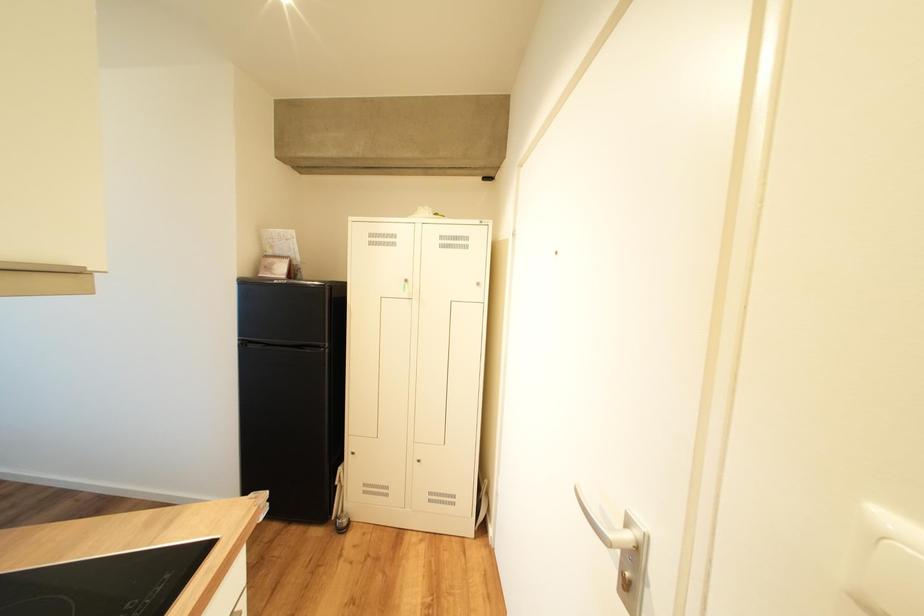
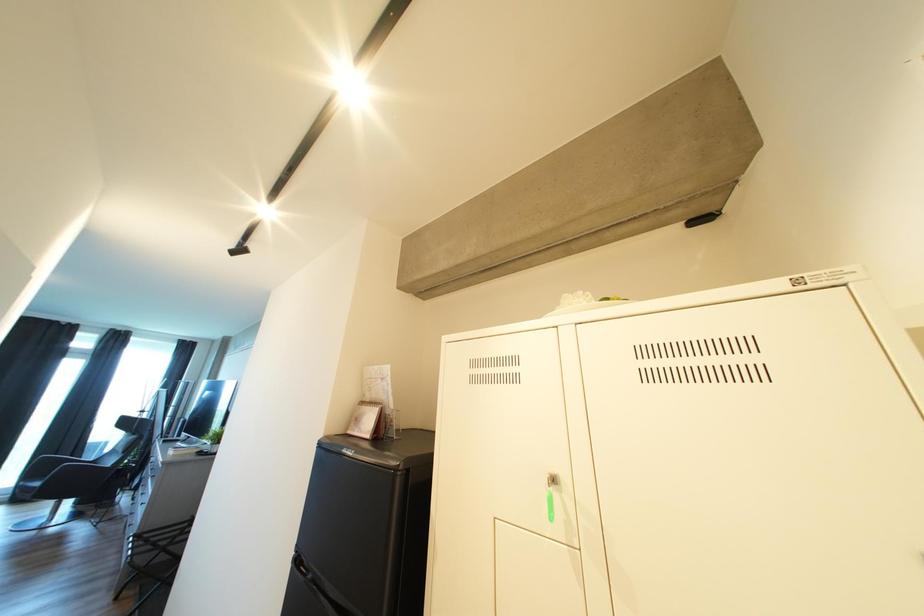
The first image is from the beginning of the video and the second image is from the end. How did the camera likely rotate when shooting the video?

The camera's rotation is toward left-up.